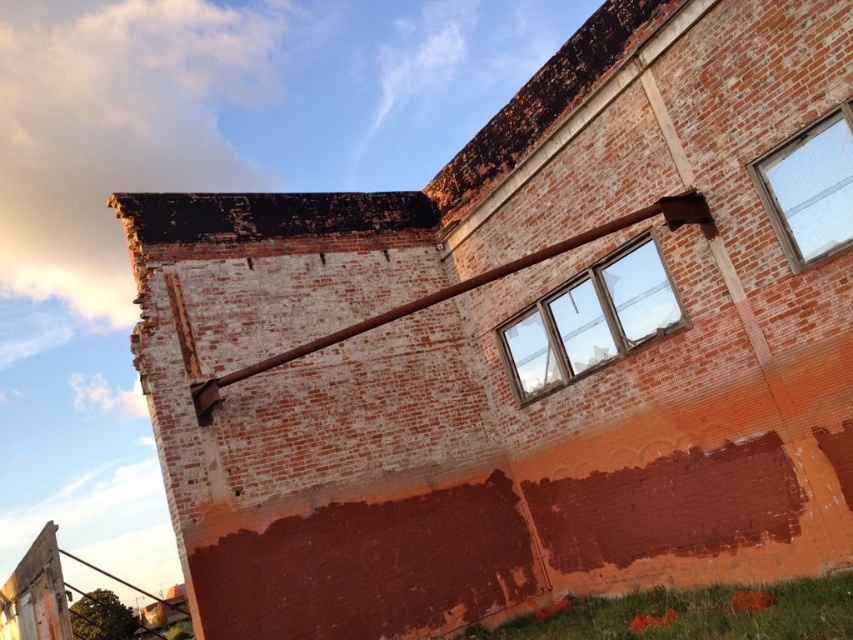
Between point (614, 337) and point (807, 147), which one is positioned in front?

Point (807, 147) is more forward.

Between point (604, 308) and point (843, 118), which one is positioned behind?

The point (604, 308) is behind.

Looking at this image, who is more distant from viewer, (573, 369) or (780, 188)?

The point (573, 369) is more distant.

This screenshot has height=640, width=853. Identify the location of clear glass window at center. (590, 317).